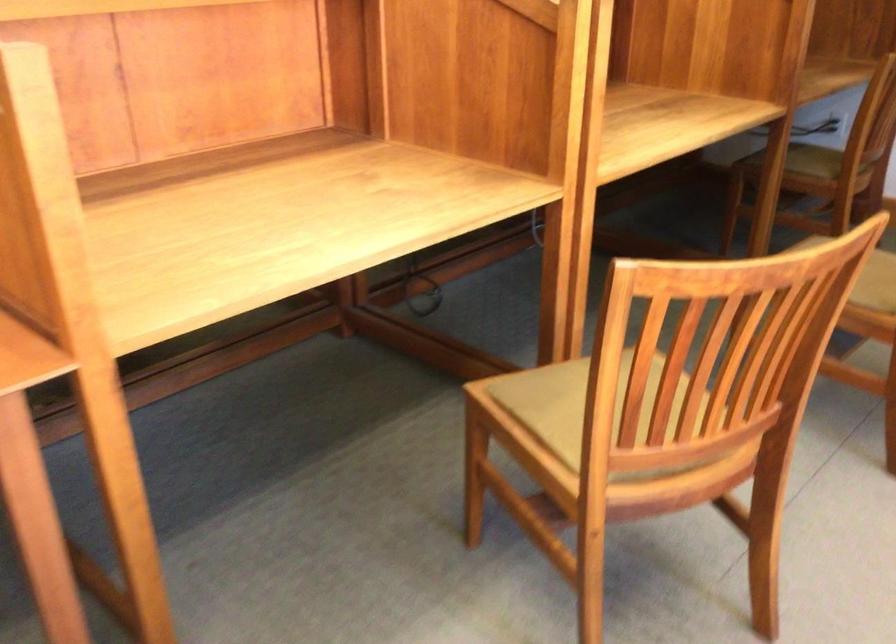
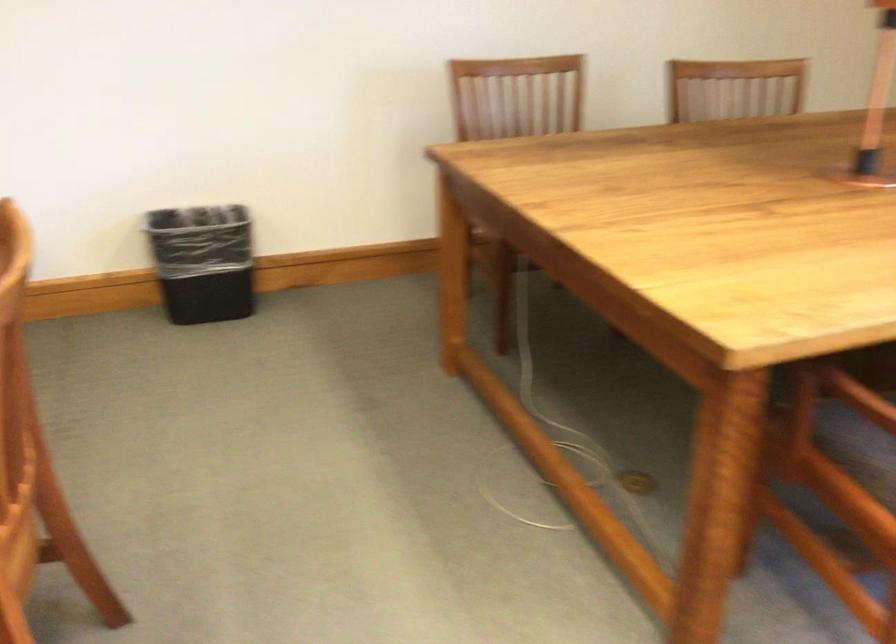
Question: The camera is either moving clockwise (left) or counter-clockwise (right) around the object. The first image is from the beginning of the video and the second image is from the end. Is the camera moving left or right when shooting the video?

Choices:
 (A) Left
 (B) Right

Answer: (A)